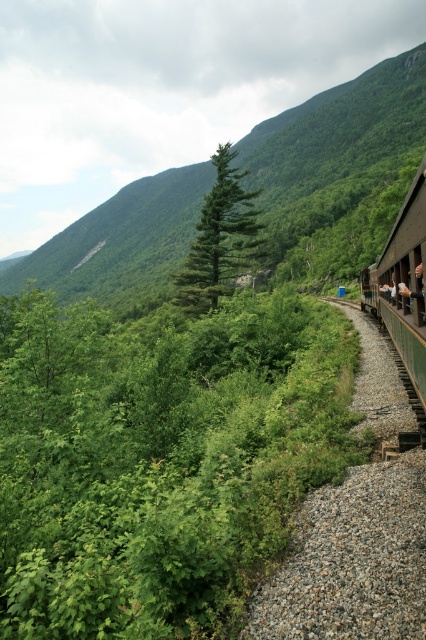
Question: Which point is closer to the camera taking this photo?

Choices:
 (A) (255, 164)
 (B) (397, 353)
 (C) (236, 216)

Answer: (B)

Question: Which object appears farthest from the camera in this image?

Choices:
 (A) green wooden train at right
 (B) green leafy hillside at upper left
 (C) green leafy shrubs at center

Answer: (B)

Question: Can you confirm if green leafy shrubs at center is positioned below green matte tree at center?

Choices:
 (A) yes
 (B) no

Answer: (A)

Question: Does green leafy hillside at upper left appear on the left side of green wooden train at right?

Choices:
 (A) no
 (B) yes

Answer: (B)

Question: Can you confirm if green leafy shrubs at center is wider than green leafy hillside at upper left?

Choices:
 (A) yes
 (B) no

Answer: (B)

Question: Which point is closer to the camera taking this photo?

Choices:
 (A) (374, 273)
 (B) (256, 355)
 (C) (219, 285)
 (D) (192, 186)

Answer: (A)